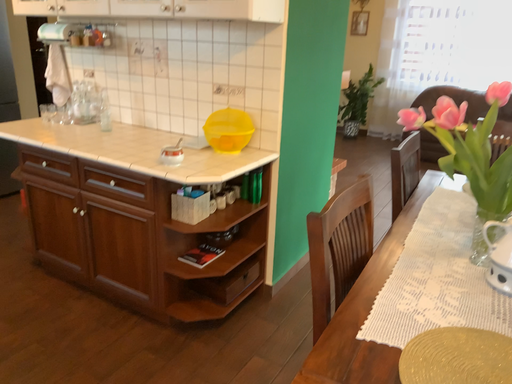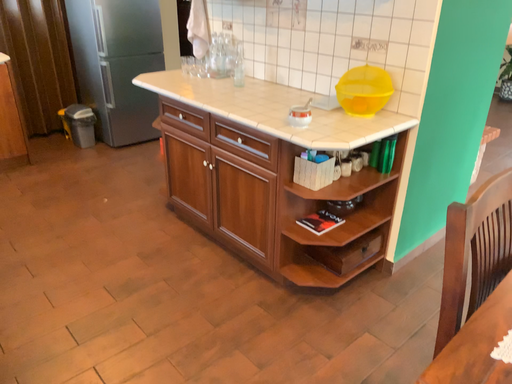
Question: Which way did the camera rotate in the video?

Choices:
 (A) rotated right
 (B) rotated left

Answer: (B)